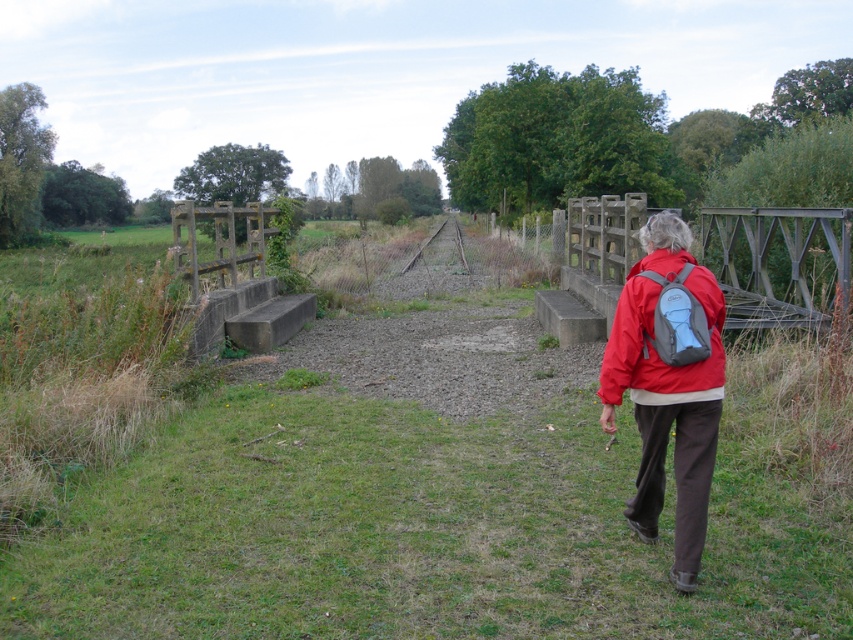
You are a photographer trying to capture the person in the scene. You want to ensure both the red nylon jacket at center and the gray fabric backpack at right are clearly visible in your shot. Based on their sizes, which object should you focus on to ensure both are in frame?

The red nylon jacket at center might be wider than the gray fabric backpack at right, so focusing on the red nylon jacket at center would help ensure both are in frame since it is larger and central.

You are a photographer trying to capture the gray fabric backpack at right in your shot. The camera you are using has a limited field of view. Based on the scene description, can you confirm if the backpack is positioned within the lower half of the image?

The gray fabric backpack at right is located at point coordinates of 0.503 on the x axis and 0.795 on the y axis. Since the y coordinate is 0.795, which is above the halfway point of 0.5, the backpack is in the upper half of the image and not in the lower half.

You are standing at the origin point of the coordinate system in the image. The red nylon jacket at center is at point (668, 385). If you want to walk directly towards the red nylon jacket at center, which direction should you move in terms of the coordinate system?

To move towards the red nylon jacket at center located at point (668, 385) from the origin, you should move in the positive x and positive y direction since both coordinates are greater than zero.